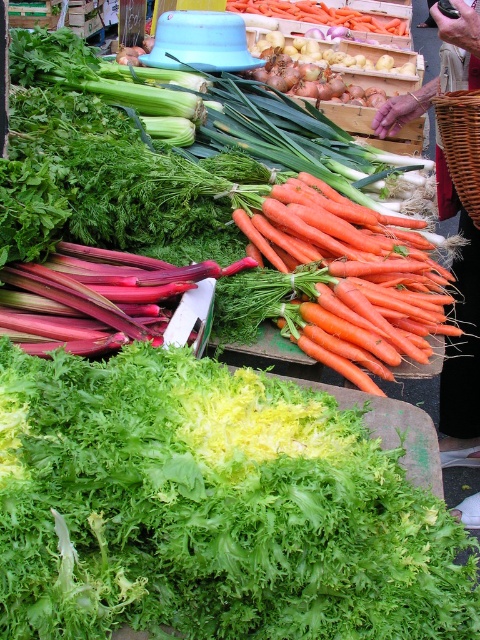
Question: Which object is the farthest from the orange matte carrots at center?

Choices:
 (A) orange smooth carrots at center
 (B) woven brown basket at center-right

Answer: (A)

Question: Does green leafy lettuce at center appear under orange smooth carrots at center?

Choices:
 (A) yes
 (B) no

Answer: (A)

Question: Where is orange smooth carrots at center located in relation to woven brown basket at center-right in the image?

Choices:
 (A) right
 (B) left

Answer: (B)

Question: Which object appears closest to the camera in this image?

Choices:
 (A) orange matte carrots at center
 (B) orange smooth carrots at center

Answer: (B)

Question: Which object appears closest to the camera in this image?

Choices:
 (A) orange smooth carrots at center
 (B) orange matte carrots at center
 (C) woven brown basket at center-right

Answer: (A)

Question: Is orange smooth carrots at center further to the viewer compared to woven brown basket at center-right?

Choices:
 (A) yes
 (B) no

Answer: (B)